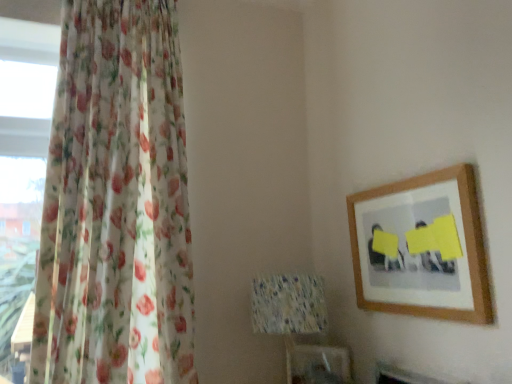
Question: From a real-world perspective, is speckled fabric lampshade at center positioned over floral sheer curtain at left based on gravity?

Choices:
 (A) yes
 (B) no

Answer: (B)

Question: Would you say speckled fabric lampshade at center is outside floral sheer curtain at left?

Choices:
 (A) no
 (B) yes

Answer: (B)

Question: From a real-world perspective, is speckled fabric lampshade at center positioned under floral sheer curtain at left based on gravity?

Choices:
 (A) yes
 (B) no

Answer: (A)

Question: Is speckled fabric lampshade at center placed right next to floral sheer curtain at left?

Choices:
 (A) yes
 (B) no

Answer: (B)

Question: Can you confirm if speckled fabric lampshade at center is positioned to the left of floral sheer curtain at left?

Choices:
 (A) yes
 (B) no

Answer: (B)

Question: Considering the relative positions of speckled fabric lampshade at center and floral sheer curtain at left in the image provided, is speckled fabric lampshade at center in front of floral sheer curtain at left?

Choices:
 (A) no
 (B) yes

Answer: (A)

Question: Considering the relative sizes of floral sheer curtain at left and wooden picture frame at upper right in the image provided, is floral sheer curtain at left thinner than wooden picture frame at upper right?

Choices:
 (A) no
 (B) yes

Answer: (A)

Question: Are floral sheer curtain at left and wooden picture frame at upper right making contact?

Choices:
 (A) no
 (B) yes

Answer: (A)

Question: From a real-world perspective, is floral sheer curtain at left under wooden picture frame at upper right?

Choices:
 (A) no
 (B) yes

Answer: (A)

Question: From the image's perspective, is floral sheer curtain at left above wooden picture frame at upper right?

Choices:
 (A) yes
 (B) no

Answer: (A)

Question: Is floral sheer curtain at left not inside wooden picture frame at upper right?

Choices:
 (A) yes
 (B) no

Answer: (A)

Question: Considering the relative positions of floral sheer curtain at left and wooden picture frame at upper right in the image provided, is floral sheer curtain at left to the right of wooden picture frame at upper right from the viewer's perspective?

Choices:
 (A) no
 (B) yes

Answer: (A)

Question: Considering the relative sizes of wooden picture frame at upper right and speckled fabric lampshade at center in the image provided, is wooden picture frame at upper right thinner than speckled fabric lampshade at center?

Choices:
 (A) yes
 (B) no

Answer: (A)